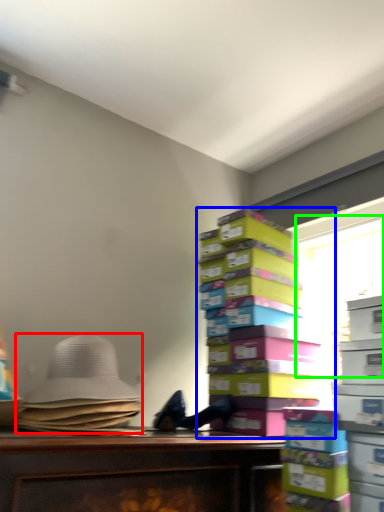
Question: Considering the real-world distances, which object is farthest from wide (highlighted by a red box)? book (highlighted by a blue box) or window screen (highlighted by a green box)?

Choices:
 (A) book
 (B) window screen

Answer: (B)